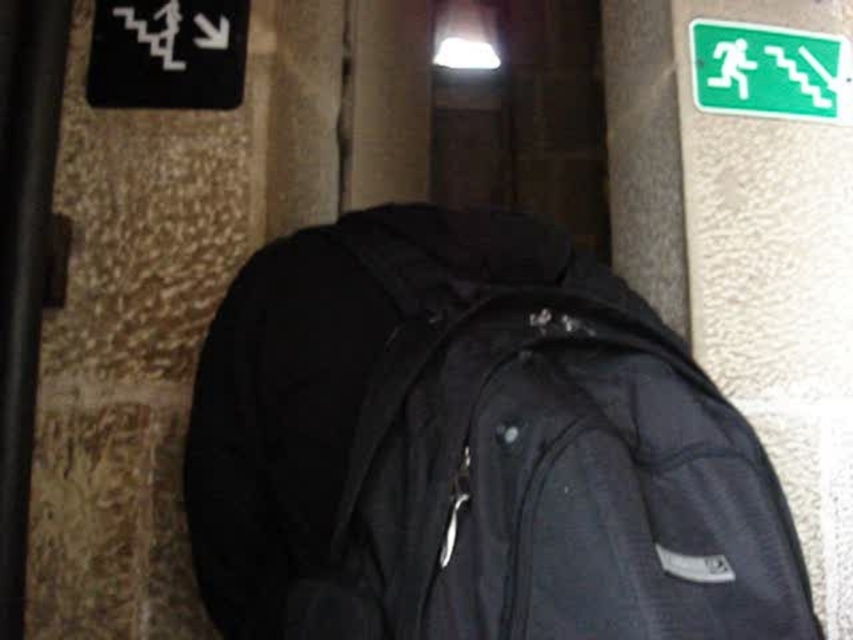
Question: Which point is closer to the camera?

Choices:
 (A) black fabric backpack at center
 (B) green plastic emergency exit sign at upper right

Answer: (A)

Question: Is black fabric backpack at center above green plastic emergency exit sign at upper right?

Choices:
 (A) no
 (B) yes

Answer: (A)

Question: Which of the following is the closest to the observer?

Choices:
 (A) (741, 100)
 (B) (338, 545)

Answer: (B)

Question: From the image, what is the correct spatial relationship of black fabric backpack at center in relation to green plastic emergency exit sign at upper right?

Choices:
 (A) above
 (B) below

Answer: (B)

Question: Which object is closer to the camera taking this photo?

Choices:
 (A) black fabric backpack at center
 (B) green plastic emergency exit sign at upper right

Answer: (A)

Question: Does black fabric backpack at center lie behind green plastic emergency exit sign at upper right?

Choices:
 (A) yes
 (B) no

Answer: (B)